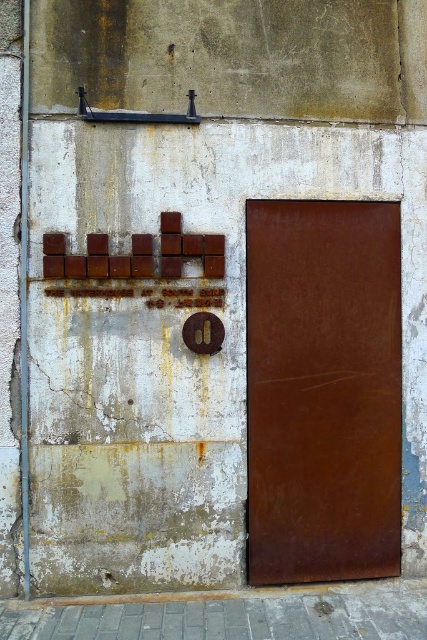
In the scene shown: Between rusty metal door at center and rusty metal door at right, which one has more height?

rusty metal door at center is taller.

Find the location of a particular element. rusty metal door at center is located at coordinates (183, 344).

This screenshot has width=427, height=640. Describe the element at coordinates (183, 344) in the screenshot. I see `rusty metal door at center` at that location.

This screenshot has height=640, width=427. I want to click on rusty metal door at center, so click(x=183, y=344).